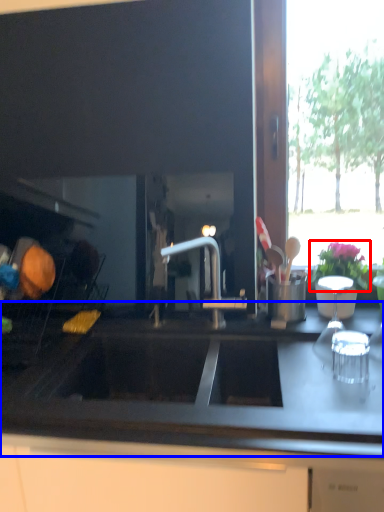
Question: Which object is closer to the camera taking this photo, flower (highlighted by a red box) or countertop (highlighted by a blue box)?

Choices:
 (A) flower
 (B) countertop

Answer: (B)